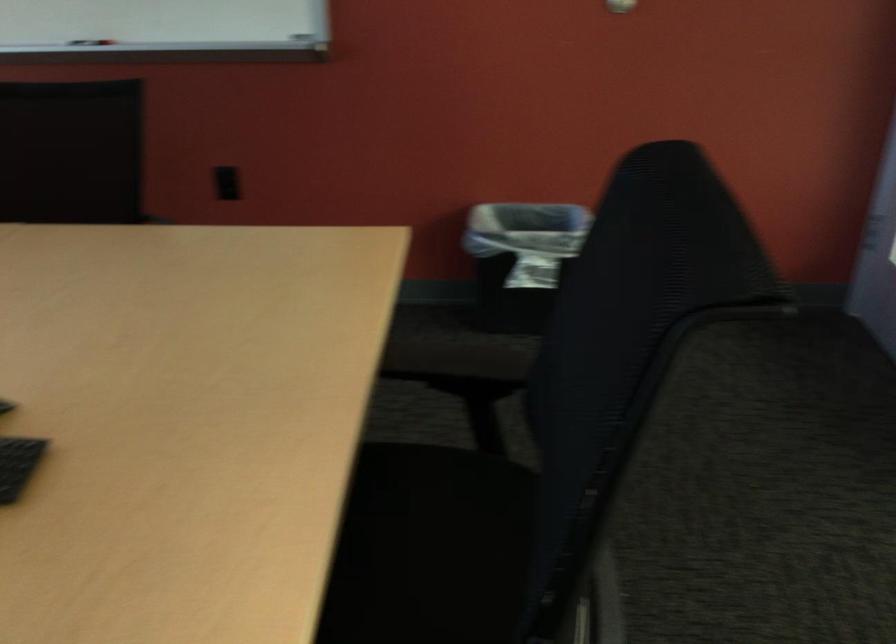
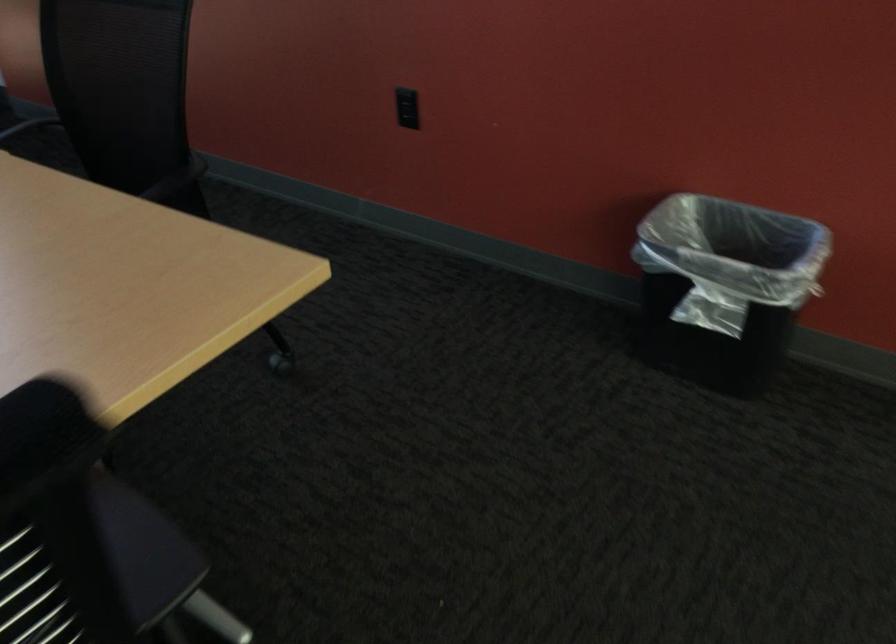
Question: The camera is either moving clockwise (left) or counter-clockwise (right) around the object. The first image is from the beginning of the video and the second image is from the end. Is the camera moving left or right when shooting the video?

Choices:
 (A) Left
 (B) Right

Answer: (B)